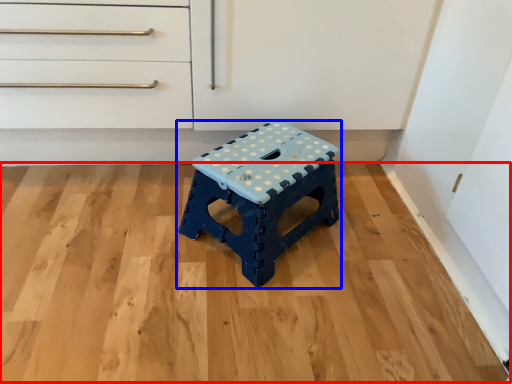
Question: Among these objects, which one is farthest to the camera, hardwood (highlighted by a red box) or stool (highlighted by a blue box)?

Choices:
 (A) hardwood
 (B) stool

Answer: (B)